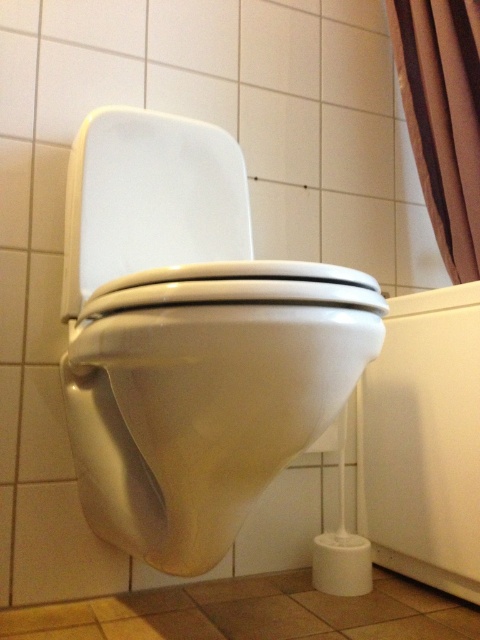
Question: Which object is closer to the camera taking this photo?

Choices:
 (A) brown fabric curtain at upper right
 (B) white matte toilet paper at lower right
 (C) white glossy toilet seat at center
 (D) white glossy toilet bowl at center

Answer: (D)

Question: Is white glossy toilet seat at center smaller than brown fabric curtain at upper right?

Choices:
 (A) yes
 (B) no

Answer: (B)

Question: Can you confirm if white glossy toilet bowl at center is positioned above brown fabric curtain at upper right?

Choices:
 (A) no
 (B) yes

Answer: (A)

Question: Is white glossy toilet bowl at center bigger than brown fabric curtain at upper right?

Choices:
 (A) yes
 (B) no

Answer: (A)

Question: Which object is the farthest from the white matte toilet paper at lower right?

Choices:
 (A) white glossy toilet bowl at center
 (B) brown fabric curtain at upper right
 (C) white glossy toilet seat at center

Answer: (B)

Question: Which point is farther from the camera taking this photo?

Choices:
 (A) (189, 147)
 (B) (458, 148)
 (C) (232, 451)
 (D) (336, 554)

Answer: (B)